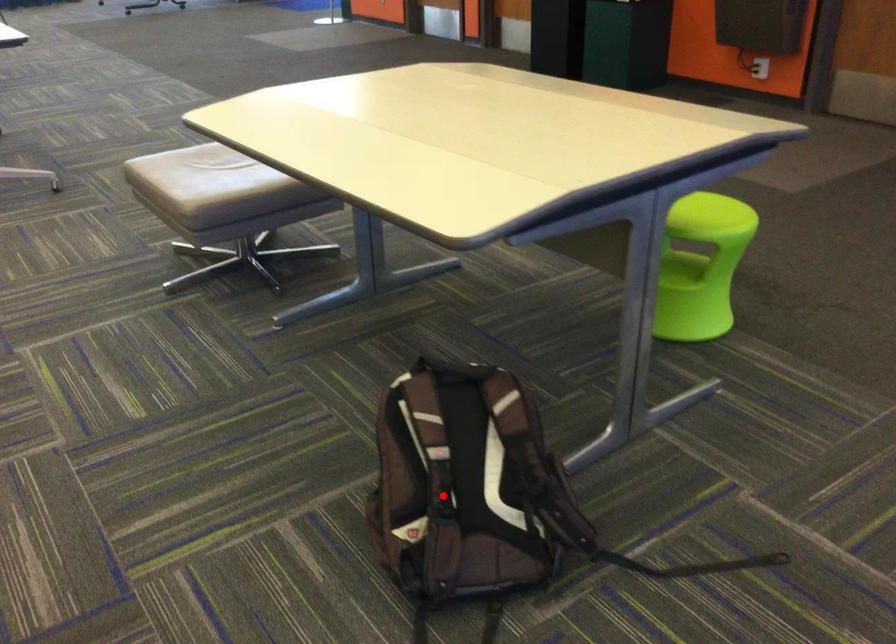
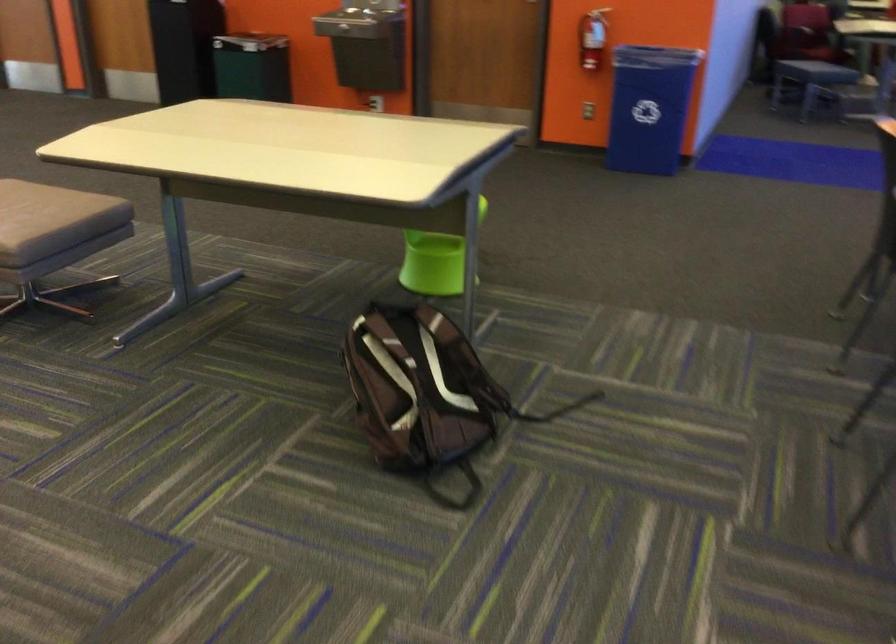
Find the pixel in the second image that matches the highlighted location in the first image.

(419, 392)